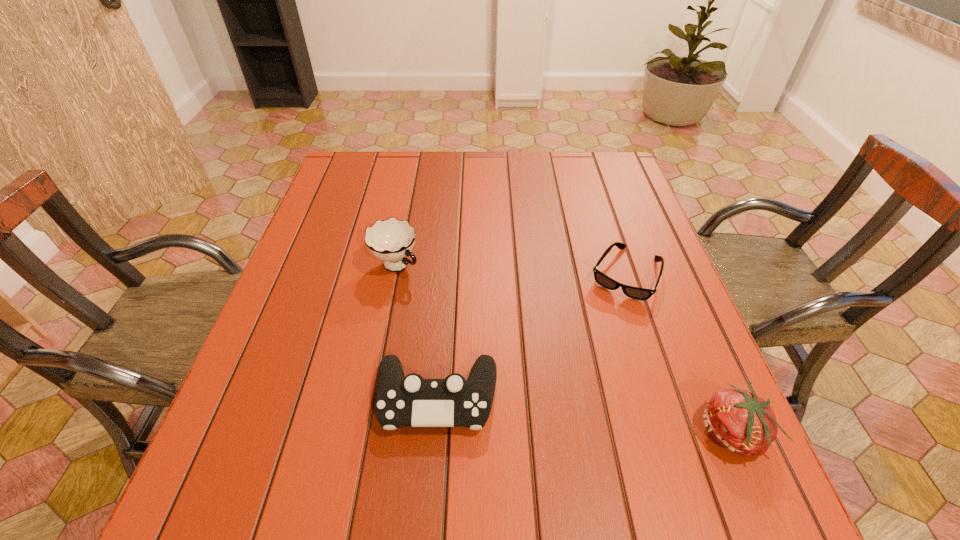
Locate an element on the screen. Image resolution: width=960 pixels, height=540 pixels. free space between the cup and the tomato is located at coordinates (564, 349).

At what (x,y) coordinates should I click in order to perform the action: click on vacant space in between the control and the cup. Please return your answer as a coordinate pair (x, y). Looking at the image, I should click on (x=417, y=332).

Locate an element on the screen. The image size is (960, 540). object that ranks as the second closest to the tomato is located at coordinates (401, 401).

Locate which object is the third closest to the tomato. Please provide its 2D coordinates. Your answer should be formatted as a tuple, i.e. [(x, y)], where the tuple contains the x and y coordinates of a point satisfying the conditions above.

[(391, 240)]

In order to click on vacant space that satisfies the following two spatial constraints: 1. on the front side of the sunglasses; 2. on the left side of the cup in this screenshot , I will do `click(395, 274)`.